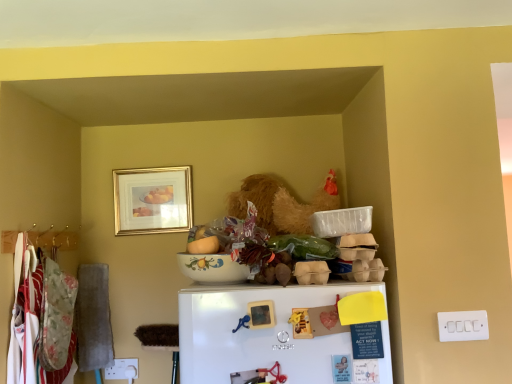
Question: Is porcelain floral bowl at center outside white plastic switch at lower right?

Choices:
 (A) yes
 (B) no

Answer: (A)

Question: Does porcelain floral bowl at center have a greater height compared to white plastic switch at lower right?

Choices:
 (A) yes
 (B) no

Answer: (B)

Question: From a real-world perspective, is porcelain floral bowl at center physically above white plastic switch at lower right?

Choices:
 (A) yes
 (B) no

Answer: (A)

Question: Is porcelain floral bowl at center positioned with its back to white plastic switch at lower right?

Choices:
 (A) no
 (B) yes

Answer: (A)

Question: Can you confirm if porcelain floral bowl at center is shorter than white plastic switch at lower right?

Choices:
 (A) no
 (B) yes

Answer: (B)

Question: From the image's perspective, is white matte refrigerator at lower center above or below floral fabric laundry at left?

Choices:
 (A) above
 (B) below

Answer: (A)

Question: From a real-world perspective, is white matte refrigerator at lower center physically located above or below floral fabric laundry at left?

Choices:
 (A) above
 (B) below

Answer: (A)

Question: Based on their sizes in the image, would you say white matte refrigerator at lower center is bigger or smaller than floral fabric laundry at left?

Choices:
 (A) small
 (B) big

Answer: (A)

Question: Which is correct: white matte refrigerator at lower center is inside floral fabric laundry at left, or outside of it?

Choices:
 (A) outside
 (B) inside

Answer: (A)

Question: In terms of width, does floral fabric laundry at left look wider or thinner when compared to metallic hanger at left?

Choices:
 (A) thin
 (B) wide

Answer: (B)

Question: Is floral fabric laundry at left in front of or behind metallic hanger at left in the image?

Choices:
 (A) behind
 (B) front

Answer: (B)

Question: Is floral fabric laundry at left to the left or to the right of metallic hanger at left in the image?

Choices:
 (A) left
 (B) right

Answer: (B)

Question: From the image's perspective, is floral fabric laundry at left above or below metallic hanger at left?

Choices:
 (A) above
 (B) below

Answer: (B)

Question: Is porcelain floral bowl at center spatially inside floral fabric laundry at left, or outside of it?

Choices:
 (A) outside
 (B) inside

Answer: (A)

Question: Is porcelain floral bowl at center wider or thinner than floral fabric laundry at left?

Choices:
 (A) wide
 (B) thin

Answer: (A)